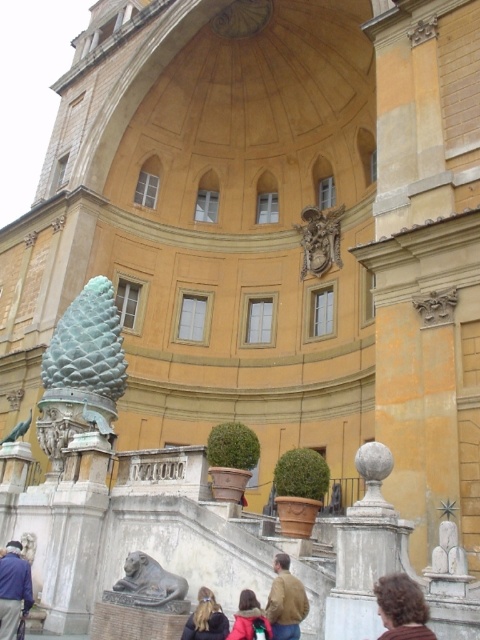
Question: Is green patina stone pinecone at center smaller than polished stone relief at center?

Choices:
 (A) no
 (B) yes

Answer: (A)

Question: Is bronze statue at lower center to the right of red wool jacket at lower center from the viewer's perspective?

Choices:
 (A) no
 (B) yes

Answer: (A)

Question: Which object appears farthest from the camera in this image?

Choices:
 (A) bronze statue at lower center
 (B) blue denim jacket at lower left
 (C) green stone pineapple at center
 (D) green patina stone pinecone at center

Answer: (C)

Question: Which point is farther to the camera?

Choices:
 (A) red wool jacket at lower center
 (B) green stone pineapple at center
 (C) green patina stone pinecone at center

Answer: (B)

Question: Among these points, which one is farthest from the camera?

Choices:
 (A) (396, 579)
 (B) (200, 611)

Answer: (B)

Question: Can you confirm if blue denim jacket at lower left is bigger than blonde hair at lower center?

Choices:
 (A) yes
 (B) no

Answer: (A)